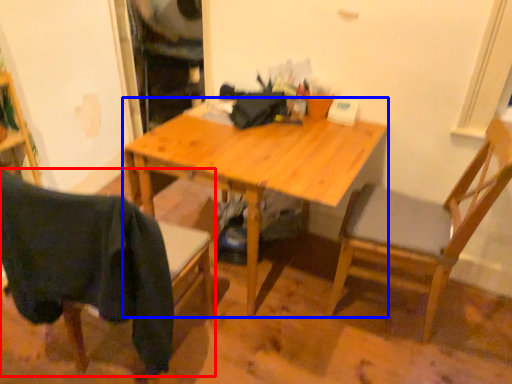
Question: Among these objects, which one is farthest to the camera, chair (highlighted by a red box) or desk (highlighted by a blue box)?

Choices:
 (A) chair
 (B) desk

Answer: (B)